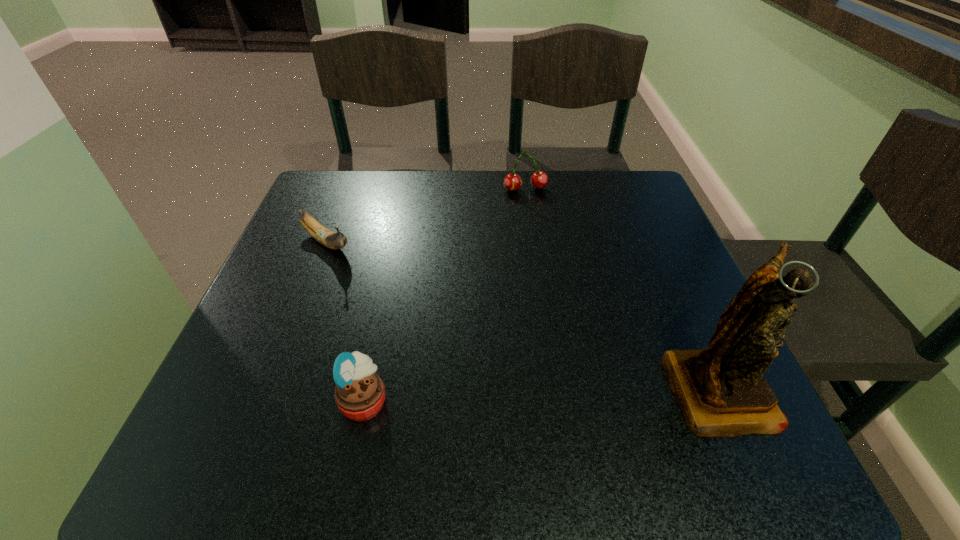
I want to click on free space between the farthest object and the shortest object, so click(x=425, y=217).

This screenshot has height=540, width=960. Identify the location of free space between the tallest object and the leftmost object. (522, 315).

Find the location of `empty location between the cherry and the muffin`. empty location between the cherry and the muffin is located at coordinates (444, 295).

I want to click on unoccupied position between the shortest object and the tallest object, so click(522, 315).

Image resolution: width=960 pixels, height=540 pixels. Find the location of `empty space between the figurine and the muffin`. empty space between the figurine and the muffin is located at coordinates (541, 394).

Find the location of a particular element. The height and width of the screenshot is (540, 960). free space between the figurine and the muffin is located at coordinates pyautogui.click(x=541, y=394).

You are a GUI agent. You are given a task and a screenshot of the screen. Output one action in this format:
    pyautogui.click(x=<x>, y=<y>)
    Task: Click on the object that can be found as the closest to the tallest object
    
    Given the screenshot: What is the action you would take?
    359,393

Locate which object is the closest to the banana. Please provide its 2D coordinates. Your answer should be formatted as a tuple, i.e. [(x, y)], where the tuple contains the x and y coordinates of a point satisfying the conditions above.

[(359, 393)]

Find the location of a particular element. vacant space that satisfies the following two spatial constraints: 1. on the front side of the figurine; 2. on the front-facing side of the leftmost object is located at coordinates (270, 387).

What are the coordinates of `vacant space that satisfies the following two spatial constraints: 1. on the back side of the shortest object; 2. on the right side of the farthest object` in the screenshot? It's located at (347, 190).